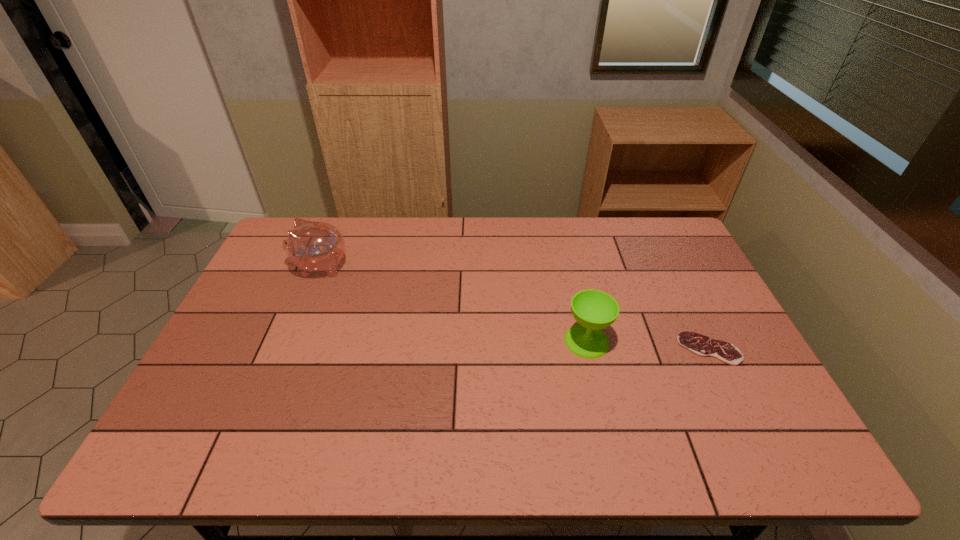
This screenshot has height=540, width=960. Find the location of `vacant region that satisfies the following two spatial constraints: 1. on the front facing side of the farthest object; 2. on the right side of the steak`. vacant region that satisfies the following two spatial constraints: 1. on the front facing side of the farthest object; 2. on the right side of the steak is located at coordinates (286, 349).

I want to click on free spot that satisfies the following two spatial constraints: 1. on the front facing side of the wineglass; 2. on the right side of the piggy bank, so click(289, 341).

Identify the location of vacant space that satisfies the following two spatial constraints: 1. on the front side of the second shortest object; 2. on the right side of the rightmost object. The image size is (960, 540). (588, 349).

Locate an element on the screen. free space in the image that satisfies the following two spatial constraints: 1. on the front facing side of the rightmost object; 2. on the right side of the piggy bank is located at coordinates (286, 349).